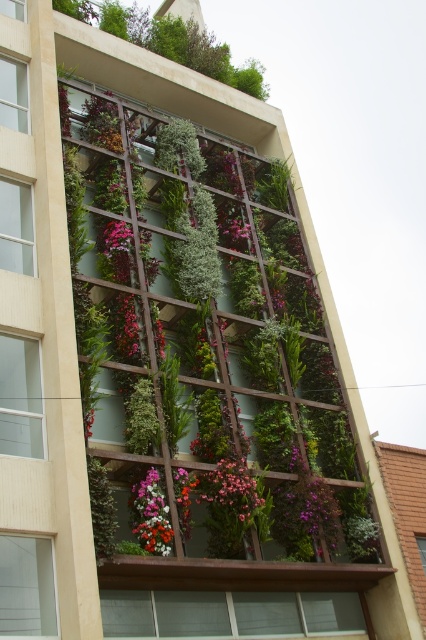
You are a window cleaner standing at the base of the building. You need to clean the windows on the left side of the image. There are two objects near the center of the scene, a pink matte flowers at center and a floral bouquet at center. Which object is closer to the windows you need to clean?

The pink matte flowers at center is 2.37 meters from floral bouquet at center, but the exact distance from the windows isn not provided. However, since both are at the center and the windows are on the left side, the floral bouquet at center and pink matte flowers at center are likely positioned towards the building facade opposite the windows. Without specific positional data relative to the windows, it is unclear which is closer to the left windows.

You are standing in front of the building with the vertical garden. You notice two elements at the center of the garden wall. Which one is positioned to the right when viewed from the front? The options are the pink matte flowers at center and the floral bouquet at center.

The pink matte flowers at center are positioned to the right of the floral bouquet at center, so the pink matte flowers at center is the one on the right.

You are standing in front of the building with the vertical garden. You notice two points marked on the wall. The first point is at coordinates point (215,486) and the second is at point (172,545). Which point is closer to you?

Point (215,486) is further to the camera than point (172,545), so the second point is closer to you.